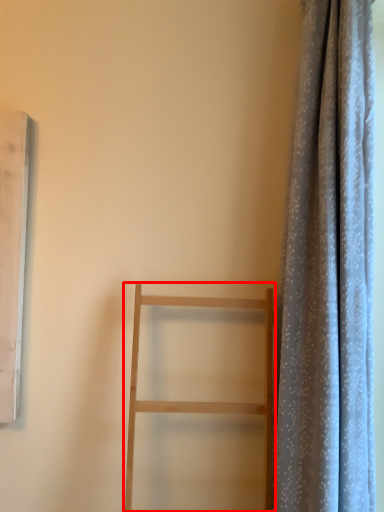
Question: In this image, where is furniture (annotated by the red box) located relative to curtain?

Choices:
 (A) right
 (B) left

Answer: (B)